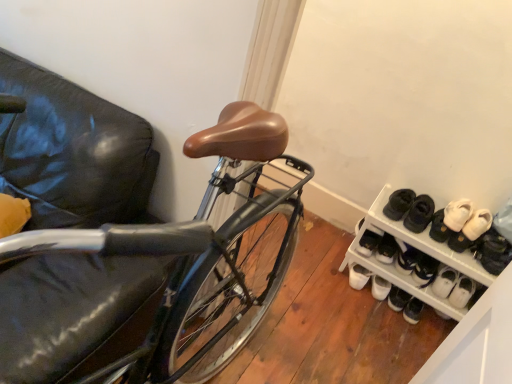
Locate an element on the screen. The image size is (512, 384). vacant area that is in front of white plastic shoe rack at lower right is located at coordinates (375, 336).